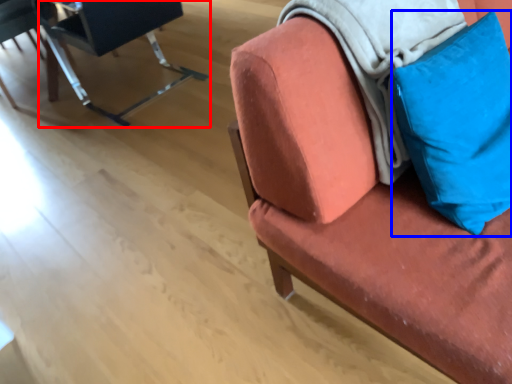
Question: Which point is further to the camera, chair (highlighted by a red box) or pillow (highlighted by a blue box)?

Choices:
 (A) chair
 (B) pillow

Answer: (A)